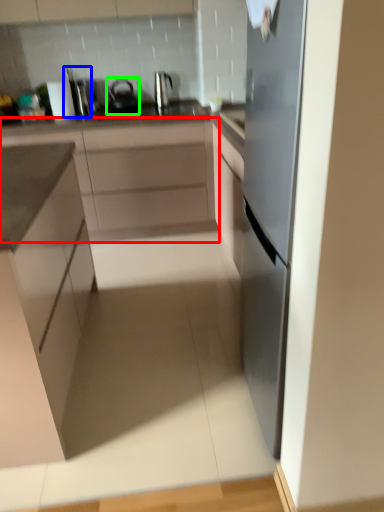
Question: Considering the real-world distances, which object is farthest from cabinetry (highlighted by a red box)? appliance (highlighted by a blue box) or tea pot (highlighted by a green box)?

Choices:
 (A) appliance
 (B) tea pot

Answer: (A)